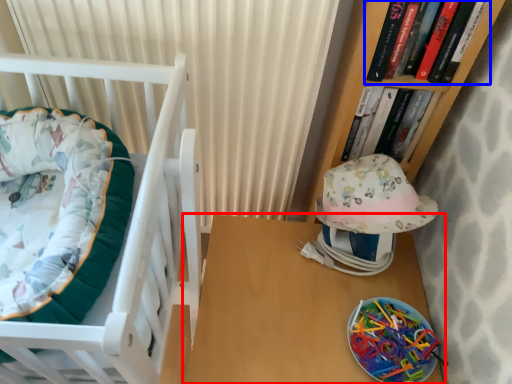
Question: Which object appears farthest to the camera in this image, table (highlighted by a red box) or book (highlighted by a blue box)?

Choices:
 (A) table
 (B) book

Answer: (A)